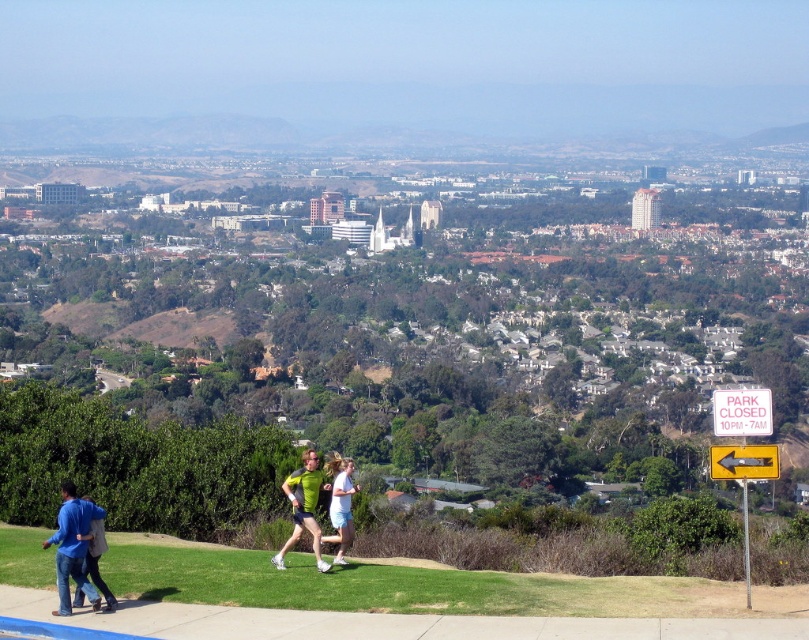
Question: Does blue denim jacket at lower left lie behind blue cotton jacket at lower left?

Choices:
 (A) yes
 (B) no

Answer: (B)

Question: Which object is closer to the camera taking this photo?

Choices:
 (A) green fabric shirt at center
 (B) blue denim jacket at lower left
 (C) light blue denim shorts at center

Answer: (B)

Question: Which point is farther to the camera?

Choices:
 (A) (342, 509)
 (B) (100, 588)
 (C) (85, 528)
 (D) (308, 477)

Answer: (D)

Question: Which point is closer to the camera?

Choices:
 (A) light blue denim shorts at center
 (B) blue cotton jacket at lower left
 (C) blue denim jacket at lower left

Answer: (C)

Question: Is green fabric shirt at center further to the viewer compared to light blue denim shorts at center?

Choices:
 (A) no
 (B) yes

Answer: (A)

Question: Does green fabric shirt at center appear on the left side of light blue denim shorts at center?

Choices:
 (A) no
 (B) yes

Answer: (B)